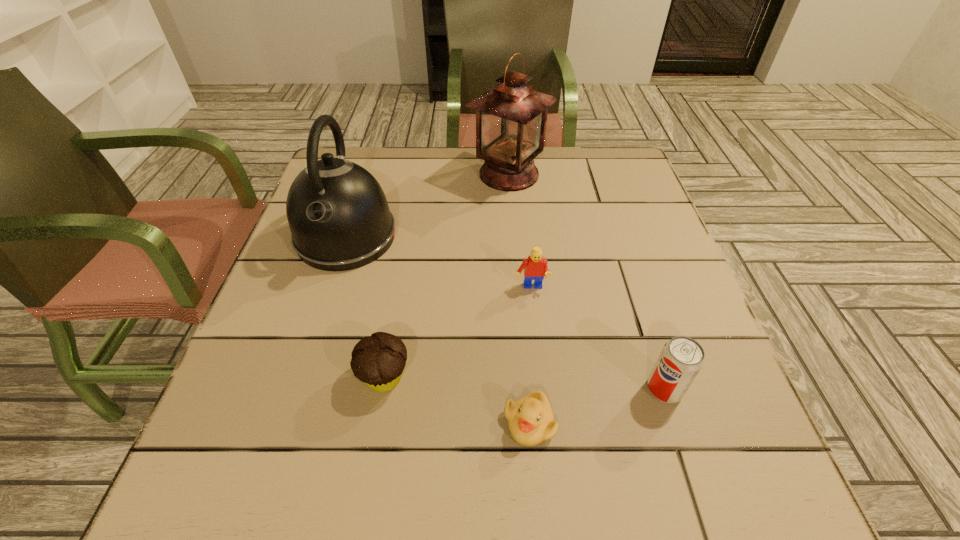
You are a GUI agent. You are given a task and a screenshot of the screen. Output one action in this format:
    pyautogui.click(x=<x>, y=<y>)
    Task: Click on the free space between the farthest object and the fifth nearest object
    This screenshot has width=960, height=540.
    Given the screenshot: What is the action you would take?
    pyautogui.click(x=427, y=205)

Identify the location of vacant point located between the second shortest object and the shortest object. (457, 400).

Select which object is the fourth closest to the fifth nearest object. Please provide its 2D coordinates. Your answer should be formatted as a tuple, i.e. [(x, y)], where the tuple contains the x and y coordinates of a point satisfying the conditions above.

[(530, 420)]

Point out which object is positioned as the fourth nearest to the kettle. Please provide its 2D coordinates. Your answer should be formatted as a tuple, i.e. [(x, y)], where the tuple contains the x and y coordinates of a point satisfying the conditions above.

[(530, 420)]

Identify the location of vacant space that satisfies the following two spatial constraints: 1. on the spout of the kettle; 2. on the right side of the soda. (298, 389).

Find the location of a particular element. vacant space that satisfies the following two spatial constraints: 1. on the front-facing side of the soda; 2. on the right side of the third farthest object is located at coordinates (541, 389).